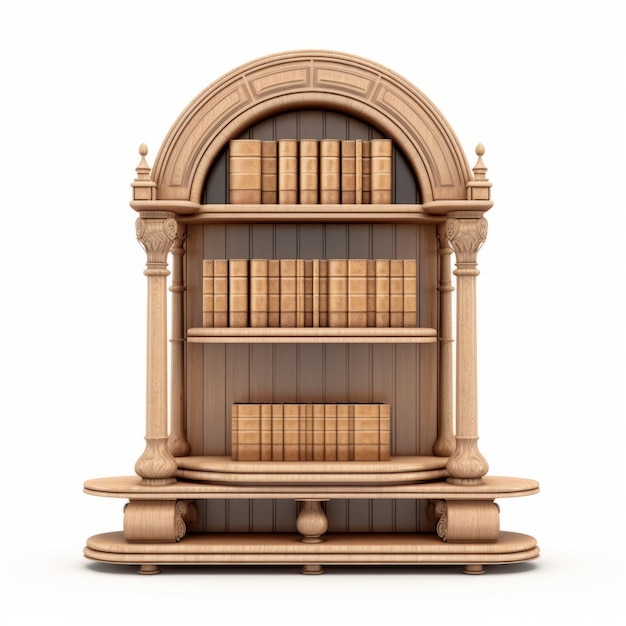
Locate an element on the screen. Image resolution: width=626 pixels, height=626 pixels. top shelf books is located at coordinates (240, 182), (267, 182), (285, 180), (307, 182), (331, 182), (346, 180), (357, 180), (366, 187), (382, 182).